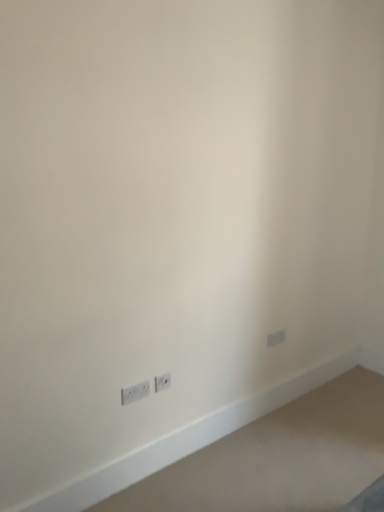
Question: Is white plastic power plugs and sockets at lower left, the first power plugs and sockets positioned from the front, positioned with its back to white plastic power plugs and sockets at lower left, marked as the 1th power plugs and sockets in a right-to-left arrangement?

Choices:
 (A) yes
 (B) no

Answer: (B)

Question: Is white plastic power plugs and sockets at lower left, the 1th power plugs and sockets in the left-to-right sequence, shorter than white plastic power plugs and sockets at lower left, marked as the 1th power plugs and sockets in a right-to-left arrangement?

Choices:
 (A) no
 (B) yes

Answer: (B)

Question: Is white plastic power plugs and sockets at lower left, the first power plugs and sockets positioned from the front, thinner than white plastic power plugs and sockets at lower left, placed as the 2th power plugs and sockets when sorted from front to back?

Choices:
 (A) yes
 (B) no

Answer: (B)

Question: From a real-world perspective, is white plastic power plugs and sockets at lower left, the first power plugs and sockets positioned from the front, physically below white plastic power plugs and sockets at lower left, placed as the 2th power plugs and sockets when sorted from front to back?

Choices:
 (A) yes
 (B) no

Answer: (A)

Question: From the image's perspective, is white plastic power plugs and sockets at lower left, placed as the second power plugs and sockets when sorted from right to left, above white plastic power plugs and sockets at lower left, placed as the 2th power plugs and sockets when sorted from front to back?

Choices:
 (A) yes
 (B) no

Answer: (B)

Question: Considering the relative sizes of white plastic power plugs and sockets at lower left, the 1th power plugs and sockets in the left-to-right sequence, and white plastic power plugs and sockets at lower left, the first power plugs and sockets when ordered from back to front, in the image provided, is white plastic power plugs and sockets at lower left, the 1th power plugs and sockets in the left-to-right sequence, taller than white plastic power plugs and sockets at lower left, the first power plugs and sockets when ordered from back to front,?

Choices:
 (A) no
 (B) yes

Answer: (A)

Question: Does white plastic power plugs and sockets at lower left, placed as the 2th power plugs and sockets when sorted from front to back, appear on the right side of white plastic power plugs and sockets at lower left, placed as the second power plugs and sockets when sorted from right to left?

Choices:
 (A) yes
 (B) no

Answer: (A)

Question: Is the surface of white plastic power plugs and sockets at lower left, marked as the 1th power plugs and sockets in a right-to-left arrangement, in direct contact with white plastic power plugs and sockets at lower left, placed as the second power plugs and sockets when sorted from right to left?

Choices:
 (A) yes
 (B) no

Answer: (B)

Question: Can you confirm if white plastic power plugs and sockets at lower left, placed as the 2th power plugs and sockets when sorted from front to back, is positioned to the left of white plastic power plugs and sockets at lower left, the first power plugs and sockets positioned from the front?

Choices:
 (A) no
 (B) yes

Answer: (A)

Question: Does white plastic power plugs and sockets at lower left, acting as the 2th power plugs and sockets starting from the left, have a lesser width compared to white plastic power plugs and sockets at lower left, the first power plugs and sockets positioned from the front?

Choices:
 (A) yes
 (B) no

Answer: (A)

Question: Is white plastic power plugs and sockets at lower left, the first power plugs and sockets when ordered from back to front, positioned before white plastic power plugs and sockets at lower left, which is the second power plugs and sockets from back to front?

Choices:
 (A) yes
 (B) no

Answer: (B)

Question: From a real-world perspective, is white plastic power plugs and sockets at lower left, the first power plugs and sockets when ordered from back to front, located beneath white plastic power plugs and sockets at lower left, the 1th power plugs and sockets in the left-to-right sequence?

Choices:
 (A) no
 (B) yes

Answer: (A)

Question: Is white plastic power plugs and sockets at lower left, the 1th power plugs and sockets in the left-to-right sequence, in front of or behind white plastic power plugs and sockets at lower left, acting as the 2th power plugs and sockets starting from the left, in the image?

Choices:
 (A) front
 (B) behind

Answer: (A)